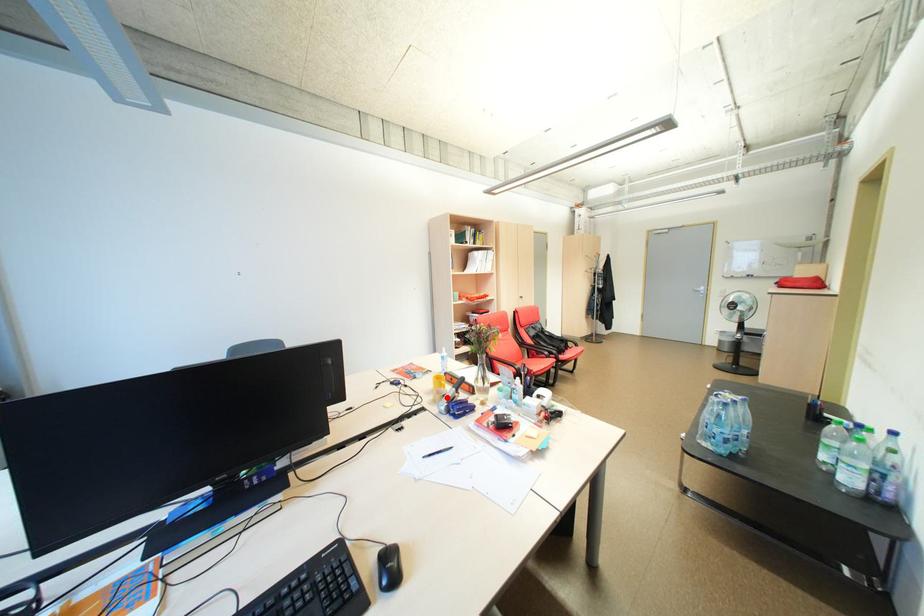
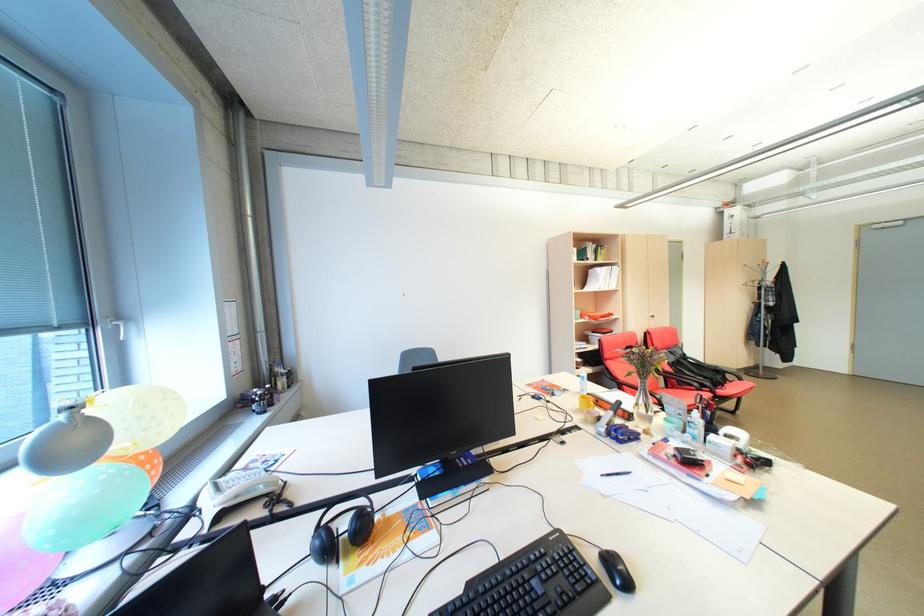
Find the pixel in the second image that matches the highlighted location in the first image.

(600, 418)